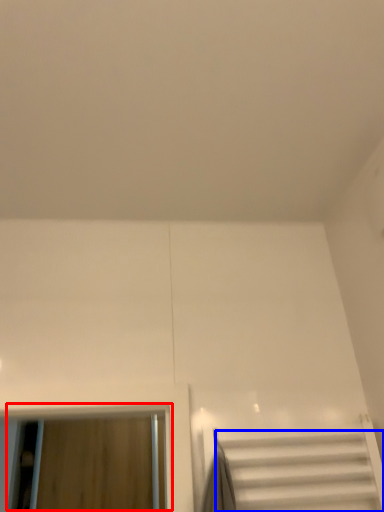
Question: Which point is closer to the camera, window (highlighted by a red box) or stairs (highlighted by a blue box)?

Choices:
 (A) window
 (B) stairs

Answer: (B)